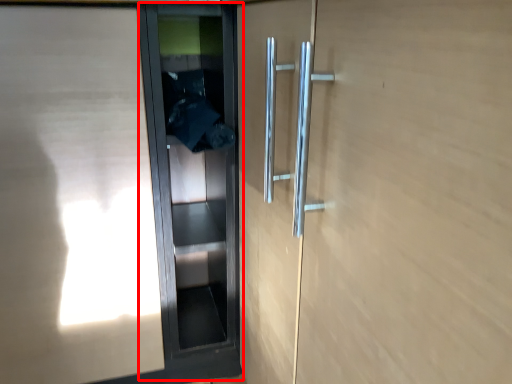
Question: From the image's perspective, what is the correct spatial positioning of elevator door (annotated by the red box) in reference to elevator door?

Choices:
 (A) below
 (B) above

Answer: (A)